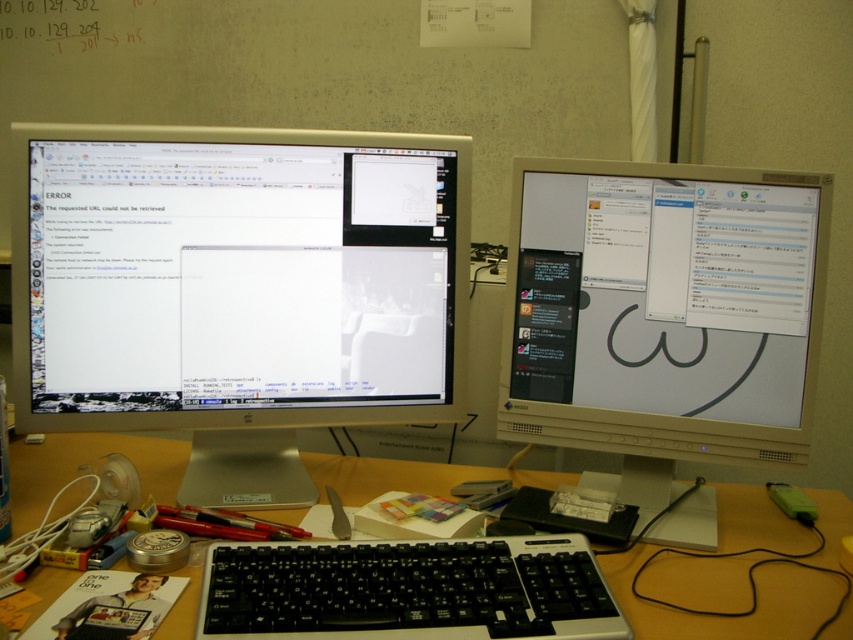
Where is `satin silver monitor at left`? The width and height of the screenshot is (853, 640). satin silver monitor at left is located at coordinates (236, 289).

Where is `satin silver monitor at left`? The width and height of the screenshot is (853, 640). satin silver monitor at left is located at coordinates (236, 289).

Who is lower down, satin silver monitor at left or black plastic keyboard at center?

black plastic keyboard at center is below.

Based on the photo, which of these two, satin silver monitor at left or black plastic keyboard at center, stands shorter?

black plastic keyboard at center

What are the coordinates of `satin silver monitor at left` in the screenshot? It's located at (236, 289).

Is beige plastic monitor at right to the right of black plastic keyboard at center from the viewer's perspective?

Correct, you'll find beige plastic monitor at right to the right of black plastic keyboard at center.

Does beige plastic monitor at right have a lesser height compared to black plastic keyboard at center?

Incorrect, beige plastic monitor at right's height does not fall short of black plastic keyboard at center's.

Is point (630, 289) closer to camera compared to point (413, 572)?

No, it is not.

Where is `beige plastic monitor at right`? beige plastic monitor at right is located at coordinates (663, 314).